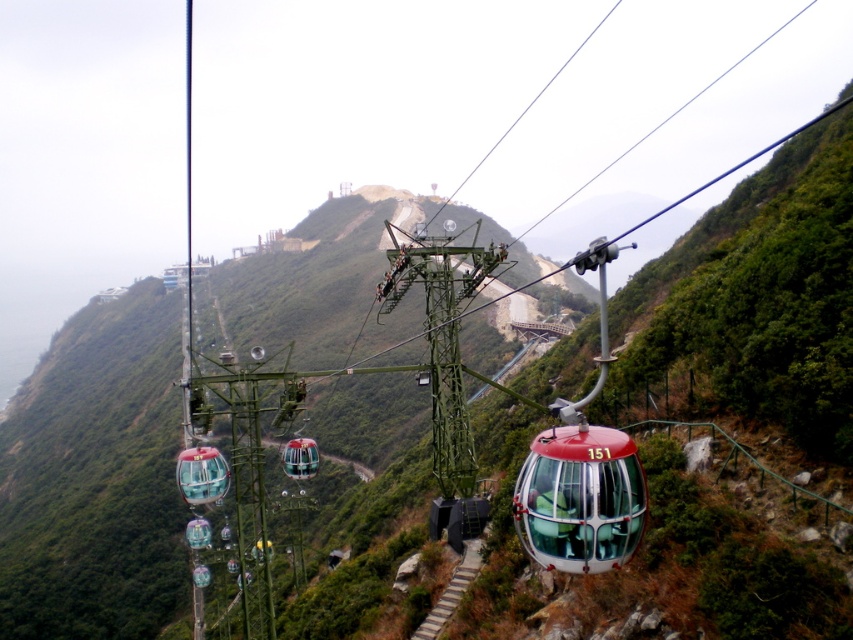
You are a tour guide explaining the cable car system to visitors. You mention the location of the metallic glass cable car at center. What coordinates should you provide to the visitors?

The metallic glass cable car at center is located at coordinates point (579, 499).

You are a tourist planning to take a photo of both the metallic glass cable car at center and the transparent glass cable car at center. Which one should you stand to the left of to capture both in your shot?

You should stand to the left of the transparent glass cable car at center because the metallic glass cable car at center is positioned on the right side of it, allowing both to be in the frame.